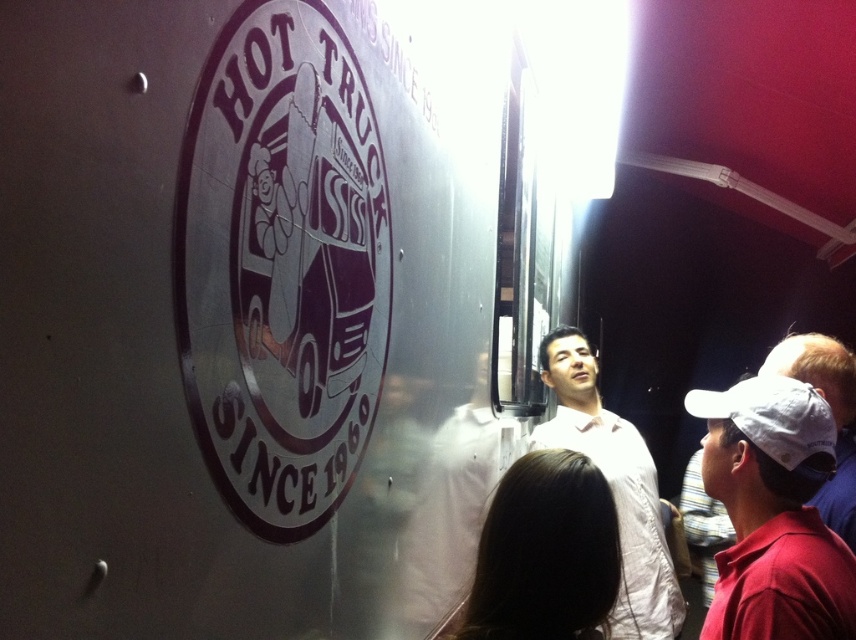
Who is taller, white matte baseball cap at upper right or brown hair at lower center?

white matte baseball cap at upper right is taller.

Is white matte baseball cap at upper right positioned at the back of brown hair at lower center?

Yes, white matte baseball cap at upper right is further from the viewer.

Locate an element on the screen. Image resolution: width=856 pixels, height=640 pixels. white matte baseball cap at upper right is located at coordinates (773, 513).

Who is higher up, metallic silver food truck at center or brown hair at lower center?

Positioned higher is metallic silver food truck at center.

Is metallic silver food truck at center above brown hair at lower center?

Yes.

Who is more distant from viewer, (100, 358) or (519, 508)?

The point (519, 508) is behind.

Image resolution: width=856 pixels, height=640 pixels. I want to click on metallic silver food truck at center, so click(263, 308).

Which of these two, white matte baseball cap at upper right or white matte shirt at center, stands shorter?

white matte baseball cap at upper right

Can you confirm if white matte baseball cap at upper right is positioned to the right of white matte shirt at center?

Correct, you'll find white matte baseball cap at upper right to the right of white matte shirt at center.

Locate an element on the screen. The width and height of the screenshot is (856, 640). white matte baseball cap at upper right is located at coordinates (773, 513).